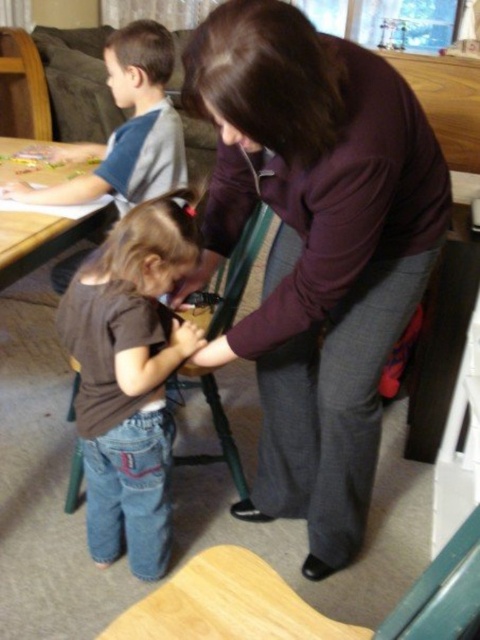
Question: Where is purple matte sweater at center located in relation to brown denim jeans at lower left in the image?

Choices:
 (A) above
 (B) below

Answer: (A)

Question: Among these objects, which one is nearest to the camera?

Choices:
 (A) wooden table at left
 (B) gray-blue t-shirt at upper left
 (C) brown denim jeans at lower left

Answer: (C)

Question: Where is purple matte sweater at center located in relation to wooden table at left in the image?

Choices:
 (A) left
 (B) right

Answer: (B)

Question: Among these points, which one is nearest to the camera?

Choices:
 (A) (271, 148)
 (B) (153, 33)
 (C) (92, 301)
 (D) (3, 282)

Answer: (A)

Question: Does gray-blue t-shirt at upper left have a larger size compared to wooden table at left?

Choices:
 (A) yes
 (B) no

Answer: (B)

Question: Which object appears farthest from the camera in this image?

Choices:
 (A) purple matte sweater at center
 (B) wooden table at left
 (C) gray-blue t-shirt at upper left
 (D) brown denim jeans at lower left

Answer: (C)